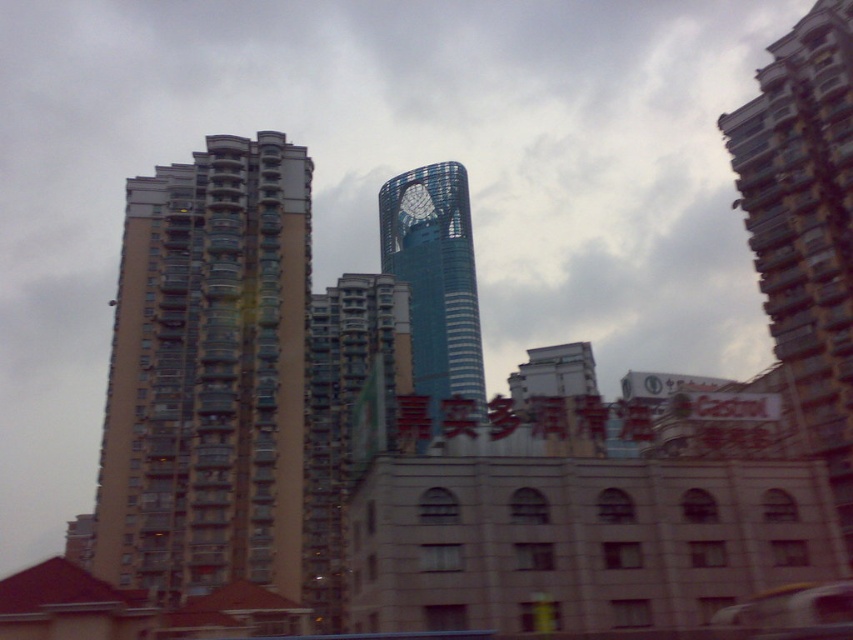
Question: Is beige concrete building at left thinner than blue glassy tower at center?

Choices:
 (A) yes
 (B) no

Answer: (A)

Question: Which of the following is the closest to the observer?

Choices:
 (A) (467, 211)
 (B) (200, 435)

Answer: (B)

Question: Is beige concrete building at left below blue glassy tower at center?

Choices:
 (A) no
 (B) yes

Answer: (B)

Question: Is beige concrete building at left to the right of blue glassy tower at center from the viewer's perspective?

Choices:
 (A) no
 (B) yes

Answer: (A)

Question: Which point is farther to the camera?

Choices:
 (A) blue glassy tower at center
 (B) beige concrete building at left

Answer: (B)